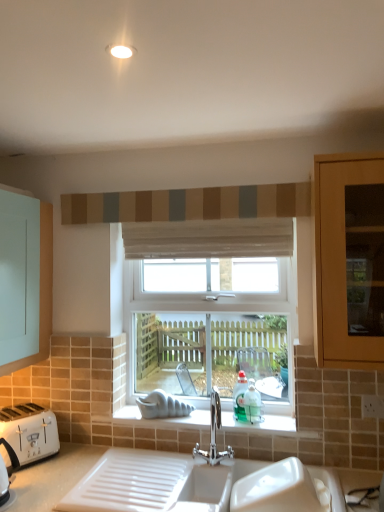
Question: Considering the relative sizes of textured fabric curtain at upper center, which is counted as the 1th curtain, starting from the top, and polished chrome tap at center in the image provided, is textured fabric curtain at upper center, which is counted as the 1th curtain, starting from the top, shorter than polished chrome tap at center?

Choices:
 (A) yes
 (B) no

Answer: (A)

Question: Is textured fabric curtain at upper center, which is counted as the 1th curtain, starting from the top, to the right of polished chrome tap at center from the viewer's perspective?

Choices:
 (A) no
 (B) yes

Answer: (A)

Question: Is textured fabric curtain at upper center, which is counted as the 1th curtain, starting from the top, further to camera compared to polished chrome tap at center?

Choices:
 (A) yes
 (B) no

Answer: (A)

Question: Considering the relative positions of textured fabric curtain at upper center, which is the second curtain from bottom to top, and polished chrome tap at center in the image provided, is textured fabric curtain at upper center, which is the second curtain from bottom to top, to the left of polished chrome tap at center from the viewer's perspective?

Choices:
 (A) yes
 (B) no

Answer: (A)

Question: Is textured fabric curtain at upper center, which is the second curtain from bottom to top, with polished chrome tap at center?

Choices:
 (A) no
 (B) yes

Answer: (A)

Question: Does point (251, 390) appear closer or farther from the camera than point (294, 188)?

Choices:
 (A) closer
 (B) farther

Answer: (B)

Question: From a real-world perspective, is teal glass bottle at window above or below textured fabric curtain at upper center, which is the second curtain from bottom to top?

Choices:
 (A) above
 (B) below

Answer: (B)

Question: Looking at their shapes, would you say teal glass bottle at window is wider or thinner than textured fabric curtain at upper center, which is counted as the 1th curtain, starting from the top?

Choices:
 (A) wide
 (B) thin

Answer: (A)

Question: Visually, is teal glass bottle at window positioned to the left or to the right of textured fabric curtain at upper center, which is counted as the 1th curtain, starting from the top?

Choices:
 (A) right
 (B) left

Answer: (A)

Question: Looking at their shapes, would you say white plastic toaster at lower left is wider or thinner than teal glass bottle at window?

Choices:
 (A) wide
 (B) thin

Answer: (A)

Question: Is point (18, 412) positioned closer to the camera than point (253, 411)?

Choices:
 (A) farther
 (B) closer

Answer: (A)

Question: From their relative heights in the image, would you say white plastic toaster at lower left is taller or shorter than teal glass bottle at window?

Choices:
 (A) tall
 (B) short

Answer: (B)

Question: In the image, is white plastic toaster at lower left positioned in front of or behind teal glass bottle at window?

Choices:
 (A) behind
 (B) front

Answer: (B)

Question: Is textured fabric curtain at upper center, which is the second curtain from bottom to top, taller or shorter than polished chrome tap at center?

Choices:
 (A) short
 (B) tall

Answer: (A)

Question: Based on their sizes in the image, would you say textured fabric curtain at upper center, which is counted as the 1th curtain, starting from the top, is bigger or smaller than polished chrome tap at center?

Choices:
 (A) small
 (B) big

Answer: (B)